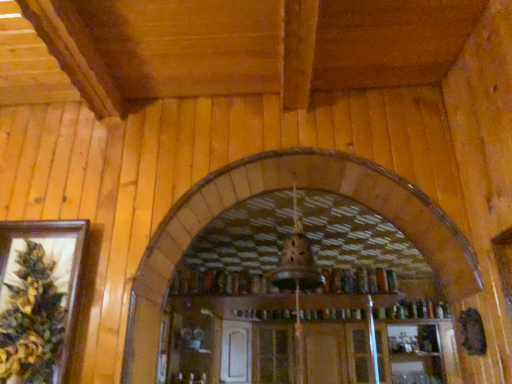
Describe the element at coordinates (304, 329) in the screenshot. I see `clear glass liquor bottles at center` at that location.

The width and height of the screenshot is (512, 384). I want to click on clear glass liquor bottles at center, so click(x=304, y=329).

Based on the photo, measure the distance between clear glass liquor bottles at center and camera.

clear glass liquor bottles at center and camera are 2.83 meters apart.

Locate an element on the screen. This screenshot has height=384, width=512. clear glass liquor bottles at center is located at coordinates (304, 329).